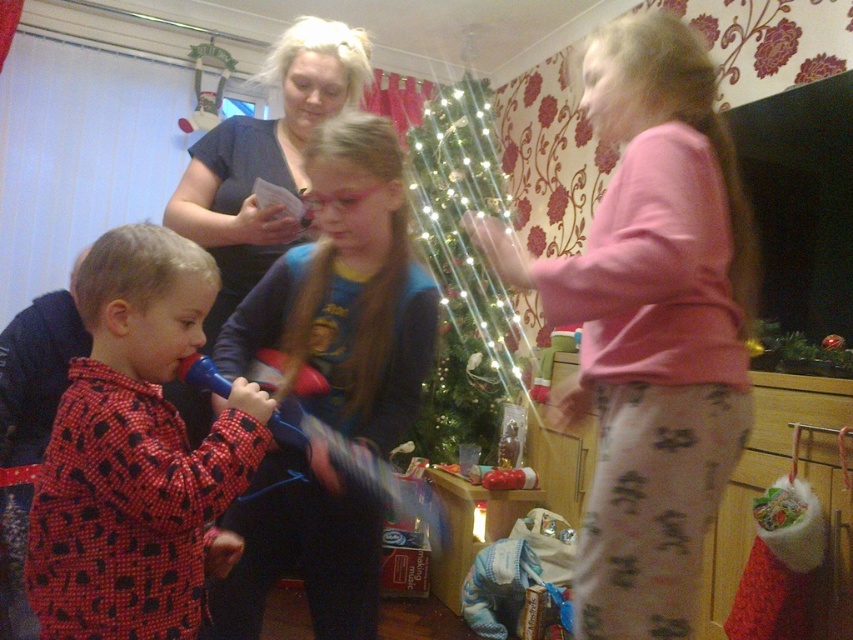
You are a photographer standing in the room. You need to take a photo of the two children wearing the red dotted pajamas at left and the blue cotton shirt at center. Which child should you focus on first to ensure they are in the frame, and why?

You should focus on the blue cotton shirt at center first because it is larger than the red dotted pajamas at left, making it easier to spot and frame in the photo.

You are a photographer at the event and need to capture a photo that includes both the pink cotton pajamas at upper right and the blue cotton shirt at center. Which one should you focus on first to ensure both are in frame?

The pink cotton pajamas at upper right is above the blue cotton shirt at center, so you should focus on the pink cotton pajamas at upper right first to ensure both are in frame.

Consider the image. You are standing in the room and want to find the pink cotton pajamas at upper right. According to the coordinates given, where should you look?

The pink cotton pajamas at upper right are located at coordinates point (650, 326).